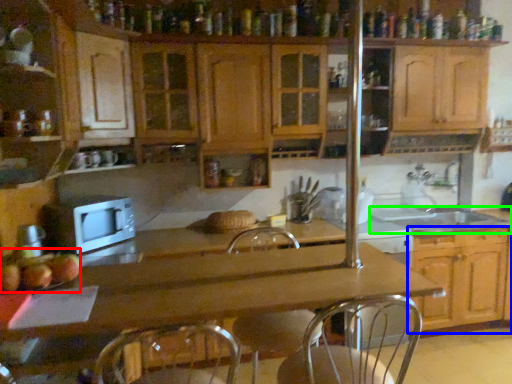
Question: Based on their relative distances, which object is farther from apple (highlighted by a red box)? Choose from cabinetry (highlighted by a blue box) and sink (highlighted by a green box).

Choices:
 (A) cabinetry
 (B) sink

Answer: (B)